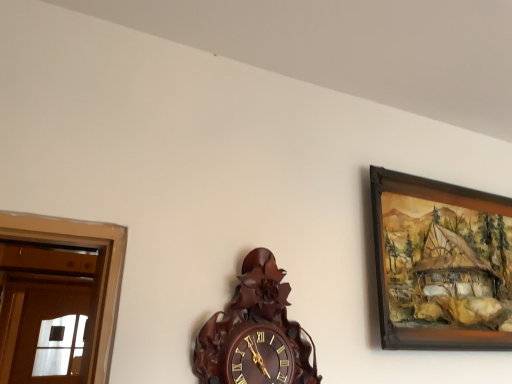
Question: Is wooden-framed painting at upper right oriented towards dark wood carved clock at center?

Choices:
 (A) yes
 (B) no

Answer: (B)

Question: Does wooden-framed painting at upper right contain dark wood carved clock at center?

Choices:
 (A) no
 (B) yes

Answer: (A)

Question: Considering the relative sizes of wooden-framed painting at upper right and dark wood carved clock at center in the image provided, is wooden-framed painting at upper right taller than dark wood carved clock at center?

Choices:
 (A) no
 (B) yes

Answer: (B)

Question: From a real-world perspective, is wooden-framed painting at upper right over dark wood carved clock at center?

Choices:
 (A) no
 (B) yes

Answer: (B)

Question: Is wooden-framed painting at upper right wider than dark wood carved clock at center?

Choices:
 (A) yes
 (B) no

Answer: (B)

Question: Is there a large distance between wooden-framed painting at upper right and dark wood carved clock at center?

Choices:
 (A) no
 (B) yes

Answer: (A)

Question: Is dark wood carved clock at center positioned in front of wooden-framed painting at upper right?

Choices:
 (A) no
 (B) yes

Answer: (B)

Question: Is dark wood carved clock at center further to the viewer compared to wooden-framed painting at upper right?

Choices:
 (A) no
 (B) yes

Answer: (A)

Question: Is dark wood carved clock at center facing towards wooden-framed painting at upper right?

Choices:
 (A) yes
 (B) no

Answer: (B)

Question: Considering the relative sizes of dark wood carved clock at center and wooden-framed painting at upper right in the image provided, is dark wood carved clock at center shorter than wooden-framed painting at upper right?

Choices:
 (A) yes
 (B) no

Answer: (A)

Question: Is there a large distance between dark wood carved clock at center and wooden-framed painting at upper right?

Choices:
 (A) yes
 (B) no

Answer: (B)

Question: From a real-world perspective, is dark wood carved clock at center physically below wooden-framed painting at upper right?

Choices:
 (A) yes
 (B) no

Answer: (A)

Question: From a real-world perspective, is dark wood carved clock at center positioned above or below wooden-framed painting at upper right?

Choices:
 (A) above
 (B) below

Answer: (B)